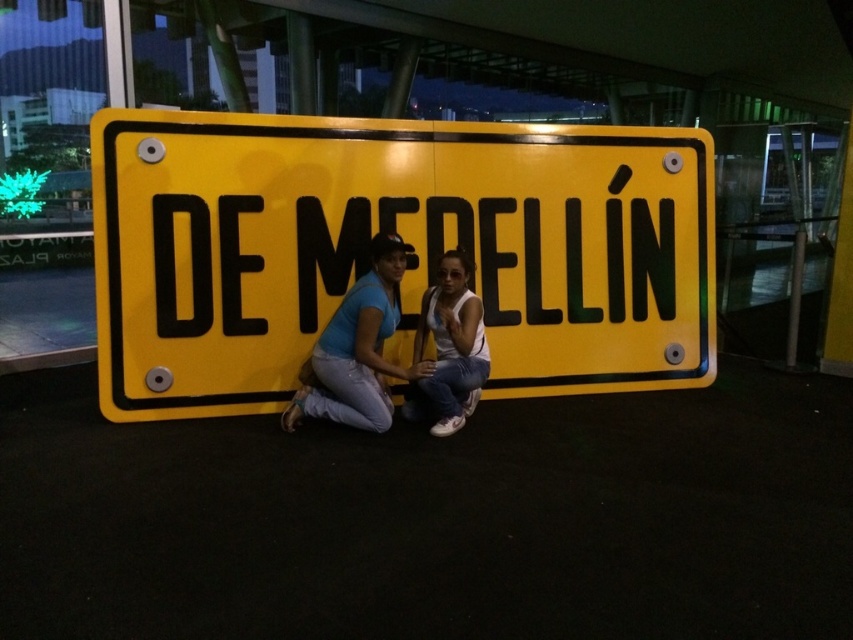
You are a photographer trying to capture a clear shot of the yellow metallic sign at center and the white matte tank top at center. Which object should you focus on first to ensure both are in focus?

You should focus on the yellow metallic sign at center first because it is closer to the viewer than the white matte tank top at center, so focusing on the closer object will ensure the farther one remains in focus.

You are standing in the scene and notice a point at coordinates (358, 349). What object is located exactly at that point?

The object at point (358, 349) is matte black clothing at center.

You are a photographer trying to capture the yellow metallic sign at center and the matte black clothing at center in a single shot. Given that the camera can only focus on one object clearly, which object should you prioritize focusing on to ensure it appears larger in the photo?

The yellow metallic sign at center has a larger size compared to matte black clothing at center, so you should prioritize focusing on the yellow metallic sign at center to ensure it appears larger in the photo.